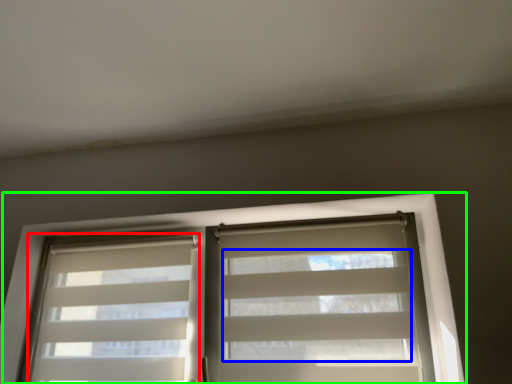
Question: Estimate the real-world distances between objects in this image. Which object is closer to shutter (highlighted by a red box), blind (highlighted by a blue box) or window (highlighted by a green box)?

Choices:
 (A) blind
 (B) window

Answer: (B)